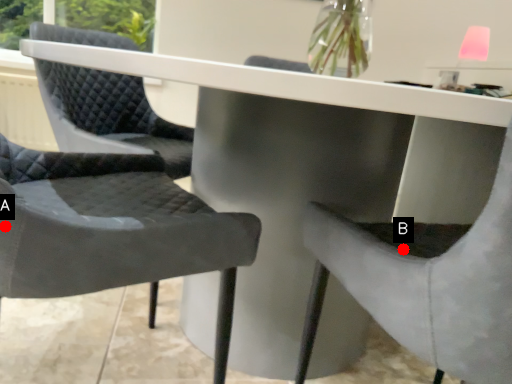
Question: Two points are circled on the image, labeled by A and B beside each circle. Which of the following is the farthest from the observer?

Choices:
 (A) A is further
 (B) B is further

Answer: (B)